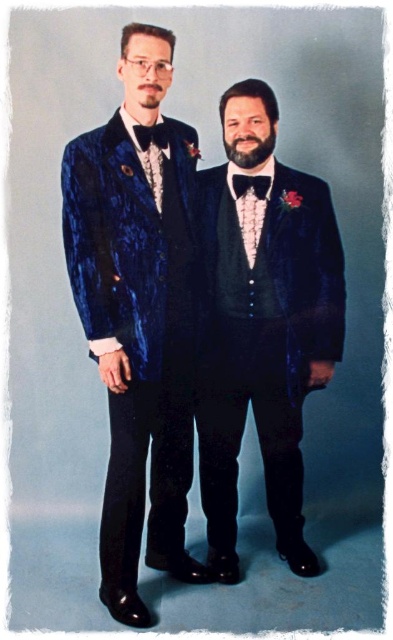
Is velvet blue tuxedo at left thinner than black satin bow tie at center?

Incorrect, velvet blue tuxedo at left's width is not less than black satin bow tie at center's.

Between point (161, 116) and point (145, 147), which one is positioned in front?

Positioned in front is point (145, 147).

Locate an element on the screen. This screenshot has height=640, width=393. velvet blue tuxedo at left is located at coordinates (137, 316).

Looking at this image, is velvet blue tuxedo at center further to camera compared to black satin bow tie at center?

Yes, it is.

Between velvet blue tuxedo at center and black satin bow tie at center, which one is positioned lower?

velvet blue tuxedo at center is lower down.

Describe the element at coordinates (264, 324) in the screenshot. The height and width of the screenshot is (640, 393). I see `velvet blue tuxedo at center` at that location.

Image resolution: width=393 pixels, height=640 pixels. Identify the location of velvet blue tuxedo at center. (264, 324).

Which is below, velvet blue tuxedo at left or velvet blue tuxedo at center?

velvet blue tuxedo at center is lower down.

Locate an element on the screen. velvet blue tuxedo at left is located at coordinates (137, 316).